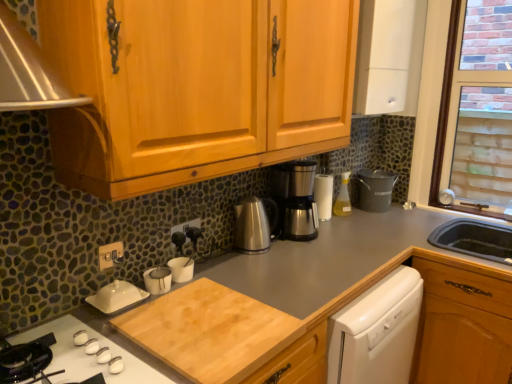
What do you see at coordinates (389, 56) in the screenshot? I see `white matte cabinet at upper right` at bounding box center [389, 56].

Describe the element at coordinates (186, 226) in the screenshot. I see `black plastic electric outlet at center, the second electric outlet when ordered from front to back` at that location.

How much space does black plastic electric outlet at center, the second electric outlet when ordered from front to back, occupy horizontally?

The width of black plastic electric outlet at center, the second electric outlet when ordered from front to back, is 0.61 inches.

You are a GUI agent. You are given a task and a screenshot of the screen. Output one action in this format:
    pyautogui.click(x=<x>, y=<y>)
    Task: Click on the translucent plastic spray bottle at center-right
    
    Given the screenshot: What is the action you would take?
    pyautogui.click(x=343, y=197)

Is brick-patterned glass at upper right positioned far away from natural wood cutting board at lower center?

Absolutely, brick-patterned glass at upper right is distant from natural wood cutting board at lower center.

How much distance is there between brick-patterned glass at upper right and natural wood cutting board at lower center?

The distance of brick-patterned glass at upper right from natural wood cutting board at lower center is 5.64 feet.

Could you tell me if brick-patterned glass at upper right is turned towards natural wood cutting board at lower center?

Yes, brick-patterned glass at upper right faces towards natural wood cutting board at lower center.

Relative to brown wood drawer at lower right, is brick-patterned glass at upper right in front or behind?

In the image, brick-patterned glass at upper right appears behind brown wood drawer at lower right.

Based on the photo, which is more to the right, brick-patterned glass at upper right or brown wood drawer at lower right?

Positioned to the right is brick-patterned glass at upper right.

Which object is wider, brick-patterned glass at upper right or brown wood drawer at lower right?

Wider between the two is brown wood drawer at lower right.

Which of these two, brick-patterned glass at upper right or brown wood drawer at lower right, stands taller?

With more height is brick-patterned glass at upper right.

Which of these two, metallic silver coffee maker at right or brick-patterned glass at upper right, stands taller?

With more height is brick-patterned glass at upper right.

Is brick-patterned glass at upper right at the back of metallic silver coffee maker at right?

That's not correct — metallic silver coffee maker at right is not looking away from brick-patterned glass at upper right.

Is metallic silver coffee maker at right bigger than brick-patterned glass at upper right?

Incorrect, metallic silver coffee maker at right is not larger than brick-patterned glass at upper right.

Which object is further away from the camera, metallic silver coffee maker at right or brick-patterned glass at upper right?

metallic silver coffee maker at right is behind.

Is satin silver coffee pot at center a part of metallic silver coffee maker at right?

No.

Looking at this image, which of these two, metallic silver coffee maker at right or satin silver coffee pot at center, is thinner?

satin silver coffee pot at center.

Between metallic silver coffee maker at right and satin silver coffee pot at center, which one is positioned behind?

metallic silver coffee maker at right is more distant.

From the image's perspective, is translucent plastic spray bottle at center-right on white glossy gas stove at lower left?

Yes, from the image's perspective, translucent plastic spray bottle at center-right is over white glossy gas stove at lower left.

Which is correct: translucent plastic spray bottle at center-right is inside white glossy gas stove at lower left, or outside of it?

translucent plastic spray bottle at center-right is not enclosed by white glossy gas stove at lower left.

Does translucent plastic spray bottle at center-right turn towards white glossy gas stove at lower left?

No, translucent plastic spray bottle at center-right does not turn towards white glossy gas stove at lower left.

Considering the relative positions of translucent plastic spray bottle at center-right and white glossy gas stove at lower left in the image provided, is translucent plastic spray bottle at center-right to the right of white glossy gas stove at lower left from the viewer's perspective?

Indeed, translucent plastic spray bottle at center-right is positioned on the right side of white glossy gas stove at lower left.

Is natural wood cutting board at lower center looking in the opposite direction of white glossy gas stove at lower left?

natural wood cutting board at lower center does not have its back to white glossy gas stove at lower left.

At what (x,y) coordinates should I click in order to perform the action: click on cutting board on the right of white glossy gas stove at lower left. Please return your answer as a coordinate pair (x, y). This screenshot has height=384, width=512. Looking at the image, I should click on (210, 331).

Which object is positioned more to the left, natural wood cutting board at lower center or white glossy gas stove at lower left?

Positioned to the left is white glossy gas stove at lower left.

Considering the sizes of objects natural wood cutting board at lower center and satin silver coffee pot at center in the image provided, who is smaller, natural wood cutting board at lower center or satin silver coffee pot at center?

satin silver coffee pot at center.

At what (x,y) coordinates should I click in order to perform the action: click on coffeepot located on the right of natural wood cutting board at lower center. Please return your answer as a coordinate pair (x, y). Looking at the image, I should click on (254, 224).

Is natural wood cutting board at lower center turned away from satin silver coffee pot at center?

No, natural wood cutting board at lower center is not facing the opposite direction of satin silver coffee pot at center.

The image size is (512, 384). What are the coordinates of `cutting board directly beneath the brick-patterned glass at upper right (from a real-world perspective)` in the screenshot? It's located at (210, 331).

This screenshot has height=384, width=512. Find the location of `window that appears behind the brown wood drawer at lower right`. window that appears behind the brown wood drawer at lower right is located at coordinates (456, 97).

When comparing their distances from satin silver coffee pot at center, does black plastic electric outlet at center, which is counted as the second electric outlet, starting from the left, or white glossy gas stove at lower left seem further?

white glossy gas stove at lower left is positioned further to the anchor satin silver coffee pot at center.

Which object lies further to the anchor point black plastic electric outlet at center, the second electric outlet when ordered from front to back, satin silver coffee machine at center or metallic silver coffee maker at right?

Among the two, metallic silver coffee maker at right is located further to black plastic electric outlet at center, the second electric outlet when ordered from front to back.

Which object lies further to the anchor point metallic silver coffee maker at right, white glossy gas stove at lower left or natural wood cutting board at lower center?

white glossy gas stove at lower left is further to metallic silver coffee maker at right.

Looking at the image, which one is located further to black plastic electric outlet at center, acting as the first electric outlet starting from the back, natural wood cutting board at lower center or translucent plastic spray bottle at center-right?

translucent plastic spray bottle at center-right is positioned further to the anchor black plastic electric outlet at center, acting as the first electric outlet starting from the back.

Considering their positions, is gold metallic switch at lower left, the 1th electric outlet viewed from the left, positioned closer to natural wood cutting board at lower center than black plastic electric outlet at center, the second electric outlet when ordered from front to back?

gold metallic switch at lower left, the 1th electric outlet viewed from the left, lies closer to natural wood cutting board at lower center than the other object.

From the image, which object appears to be farther from brick-patterned glass at upper right, brown wood drawer at lower right or white glossy gas stove at lower left?

Among the two, white glossy gas stove at lower left is located further to brick-patterned glass at upper right.

Considering their positions, is metallic silver coffee maker at right positioned further to natural wood cutting board at lower center than translucent plastic spray bottle at center-right?

metallic silver coffee maker at right is further to natural wood cutting board at lower center.

Estimate the real-world distances between objects in this image. Which object is further from black plastic electric outlet at center, which is counted as the second electric outlet, starting from the left, white matte cabinet at upper right or white glossy gas stove at lower left?

The object further to black plastic electric outlet at center, which is counted as the second electric outlet, starting from the left, is white matte cabinet at upper right.

In order to click on coffee machine between gold metallic switch at lower left, the first electric outlet from the front, and brown wood drawer at lower right from left to right in this screenshot , I will do `click(295, 200)`.

This screenshot has height=384, width=512. I want to click on coffee machine between white matte cabinet at upper right and brown wood drawer at lower right in the vertical direction, so click(295, 200).

The height and width of the screenshot is (384, 512). I want to click on coffee machine that lies between white matte cabinet at upper right and black plastic electric outlet at center, the first electric outlet viewed from the right, from top to bottom, so point(295,200).

I want to click on appliance situated between satin silver coffee pot at center and brick-patterned glass at upper right from left to right, so pyautogui.click(x=375, y=189).